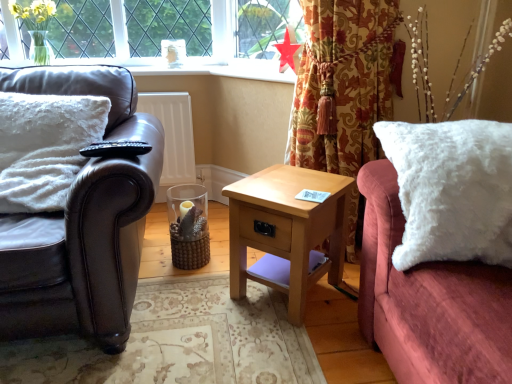
Where is `vacant space that is to the left of red paper star at upper center`? This screenshot has width=512, height=384. vacant space that is to the left of red paper star at upper center is located at coordinates [266, 68].